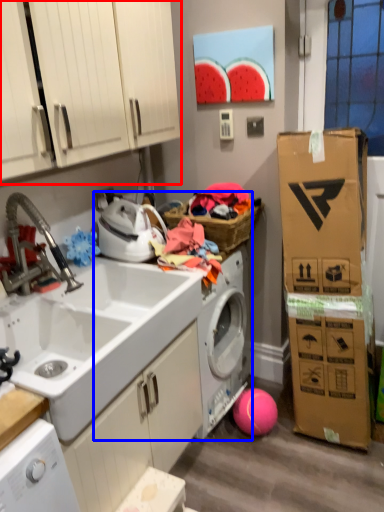
Question: Which object appears closest to the camera in this image, cabinetry (highlighted by a red box) or washing machine (highlighted by a blue box)?

Choices:
 (A) cabinetry
 (B) washing machine

Answer: (A)